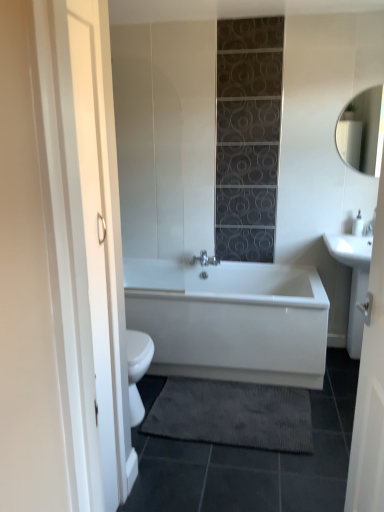
Locate an element on the screen. The image size is (384, 512). dark gray textured bath mat at lower center is located at coordinates (232, 414).

Where is `white glossy sink at right`? This screenshot has width=384, height=512. white glossy sink at right is located at coordinates (354, 277).

What are the coordinates of `matte white mirror at upper right` in the screenshot? It's located at pos(362,132).

From the picture: From a real-world perspective, is silver metallic faucet at right positioned under matte white mirror at upper right based on gravity?

Indeed, from a real-world perspective, silver metallic faucet at right is positioned beneath matte white mirror at upper right.

Is matte white mirror at upper right at the back of silver metallic faucet at right?

No, silver metallic faucet at right's orientation is not away from matte white mirror at upper right.

Between silver metallic faucet at right and matte white mirror at upper right, which one has larger size?

With larger size is matte white mirror at upper right.

Is silver metallic faucet at right next to matte white mirror at upper right and touching it?

No, silver metallic faucet at right is not with matte white mirror at upper right.

Find the location of a particular element. The width and height of the screenshot is (384, 512). sink above the dark gray textured bath mat at lower center (from the image's perspective) is located at coordinates (354, 277).

Between white glossy sink at right and dark gray textured bath mat at lower center, which one has larger width?

dark gray textured bath mat at lower center.

Considering the sizes of objects white glossy sink at right and dark gray textured bath mat at lower center in the image provided, who is smaller, white glossy sink at right or dark gray textured bath mat at lower center?

dark gray textured bath mat at lower center.

Which object is positioned more to the right, white glossy sink at right or white glossy bathtub at center?

Positioned to the right is white glossy sink at right.

Between white glossy sink at right and white glossy bathtub at center, which one has larger size?

white glossy bathtub at center.

Is white glossy sink at right far from white glossy bathtub at center?

white glossy sink at right is actually quite close to white glossy bathtub at center.

Which is in front, white glossy sink at right or white glossy bathtub at center?

white glossy bathtub at center is more forward.

Consider the image. Is silver metallic faucet at right completely or partially inside white glossy bathtub at center?

No, silver metallic faucet at right is not surrounded by white glossy bathtub at center.

Can you confirm if white glossy bathtub at center is positioned to the left of silver metallic faucet at right?

Correct, you'll find white glossy bathtub at center to the left of silver metallic faucet at right.

Considering the sizes of white glossy bathtub at center and silver metallic faucet at right in the image, is white glossy bathtub at center bigger or smaller than silver metallic faucet at right?

In the image, white glossy bathtub at center appears to be larger than silver metallic faucet at right.

Locate an element on the screen. The image size is (384, 512). bath mat that is in front of the white glossy bathtub at center is located at coordinates (232, 414).

Considering the relative positions of dark gray textured bath mat at lower center and white glossy bathtub at center in the image provided, is dark gray textured bath mat at lower center to the left of white glossy bathtub at center from the viewer's perspective?

No.

How many degrees apart are the facing directions of dark gray textured bath mat at lower center and white glossy bathtub at center?

The facing directions of dark gray textured bath mat at lower center and white glossy bathtub at center are 3.73 degrees apart.

Consider the image. Is dark gray textured bath mat at lower center facing away from white glossy bathtub at center?

No, dark gray textured bath mat at lower center is not facing away from white glossy bathtub at center.

From the image's perspective, which is below, white glossy bathtub at center or matte white mirror at upper right?

white glossy bathtub at center is shown below in the image.

From a real-world perspective, is white glossy bathtub at center physically below matte white mirror at upper right?

Yes, from a real-world perspective, white glossy bathtub at center is under matte white mirror at upper right.

Consider the image. Does white glossy bathtub at center have a larger size compared to matte white mirror at upper right?

Indeed, white glossy bathtub at center has a larger size compared to matte white mirror at upper right.

Is white glossy bathtub at center with matte white mirror at upper right?

There is a gap between white glossy bathtub at center and matte white mirror at upper right.

Between silver metallic faucet at right and white glossy sink at right, which one appears on the left side from the viewer's perspective?

white glossy sink at right is more to the left.

In terms of width, does silver metallic faucet at right look wider or thinner when compared to white glossy sink at right?

Clearly, silver metallic faucet at right has less width compared to white glossy sink at right.

Between point (372, 228) and point (332, 246), which one is positioned behind?

The point (332, 246) is more distant.

Is white glossy sink at right at the back of silver metallic faucet at right?

That's not correct — silver metallic faucet at right is not looking away from white glossy sink at right.

You are a GUI agent. You are given a task and a screenshot of the screen. Output one action in this format:
    pyautogui.click(x=<x>, y=<y>)
    Task: Click on the faucet behind the matte white mirror at upper right
    
    Given the screenshot: What is the action you would take?
    pyautogui.click(x=368, y=229)

Where is `bath mat on the left of white glossy sink at right`? The image size is (384, 512). bath mat on the left of white glossy sink at right is located at coordinates (232, 414).

Consider the image. Which object lies nearer to the anchor point white glossy bathtub at center, dark gray textured bath mat at lower center or white glossy sink at right?

The object closer to white glossy bathtub at center is dark gray textured bath mat at lower center.

From the picture: From the image, which object appears to be farther from white glossy bathtub at center, white glossy sink at right or matte white mirror at upper right?

The object further to white glossy bathtub at center is matte white mirror at upper right.

Estimate the real-world distances between objects in this image. Which object is closer to white glossy bathtub at center, dark gray textured bath mat at lower center or silver metallic faucet at right?

dark gray textured bath mat at lower center.

Looking at this image, when comparing their distances from white glossy bathtub at center, does silver metallic faucet at right or matte white mirror at upper right seem further?

The object further to white glossy bathtub at center is matte white mirror at upper right.

From the image, which object appears to be nearer to silver metallic faucet at right, matte white mirror at upper right or white glossy bathtub at center?

matte white mirror at upper right is closer to silver metallic faucet at right.

Considering their positions, is dark gray textured bath mat at lower center positioned closer to silver metallic faucet at right than matte white mirror at upper right?

The object closer to silver metallic faucet at right is matte white mirror at upper right.

Estimate the real-world distances between objects in this image. Which object is closer to white glossy sink at right, white glossy bathtub at center or matte white mirror at upper right?

The object closer to white glossy sink at right is matte white mirror at upper right.

Considering their positions, is dark gray textured bath mat at lower center positioned closer to matte white mirror at upper right than silver metallic faucet at right?

Based on the image, silver metallic faucet at right appears to be nearer to matte white mirror at upper right.

Identify the location of sink between white glossy bathtub at center and silver metallic faucet at right in the horizontal direction. (354, 277).

Where is `sink between dark gray textured bath mat at lower center and silver metallic faucet at right`? The height and width of the screenshot is (512, 384). sink between dark gray textured bath mat at lower center and silver metallic faucet at right is located at coordinates (354, 277).

The image size is (384, 512). I want to click on faucet between matte white mirror at upper right and dark gray textured bath mat at lower center in the up-down direction, so click(368, 229).

Identify the location of sink that lies between matte white mirror at upper right and white glossy bathtub at center from top to bottom. Image resolution: width=384 pixels, height=512 pixels. point(354,277).